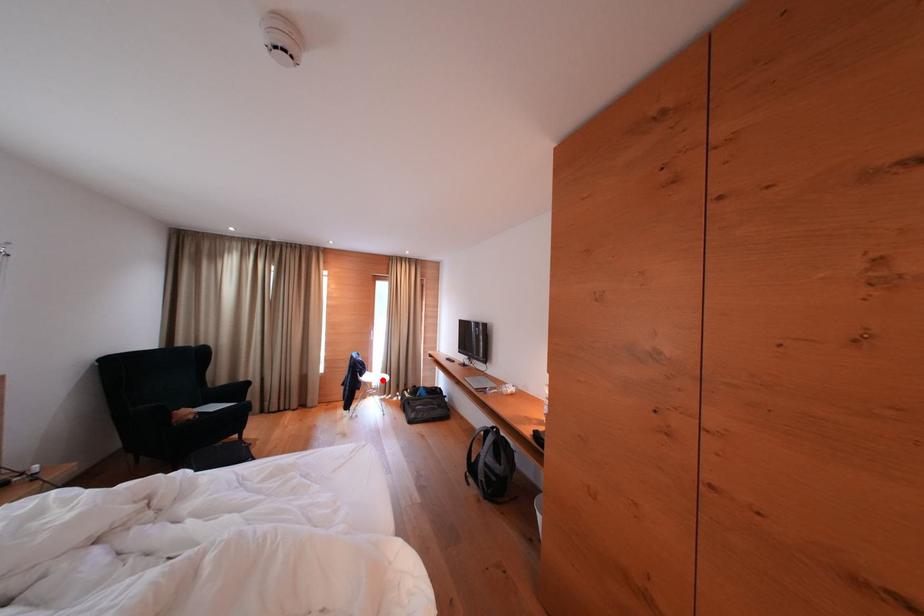
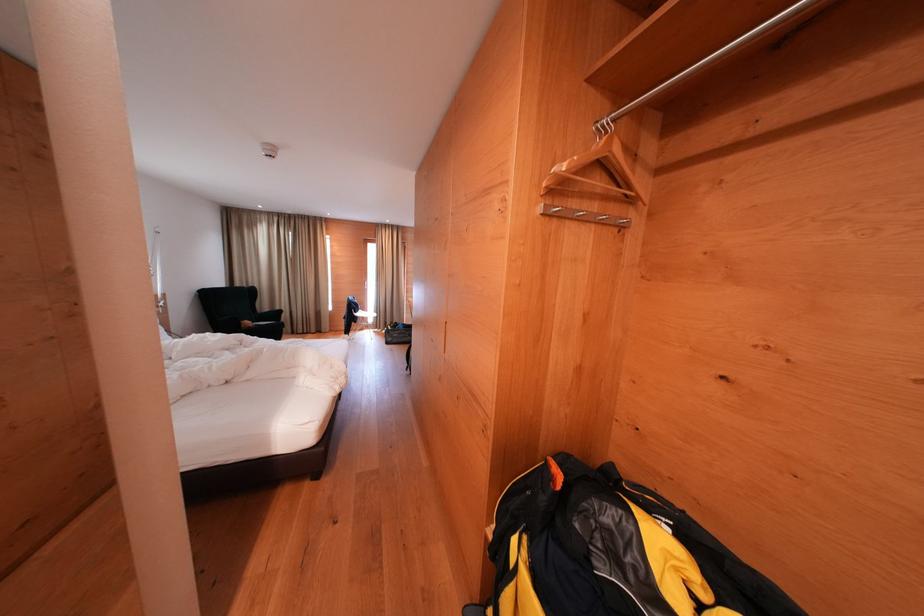
In the second image, find the point that corresponds to the highlighted location in the first image.

(374, 318)